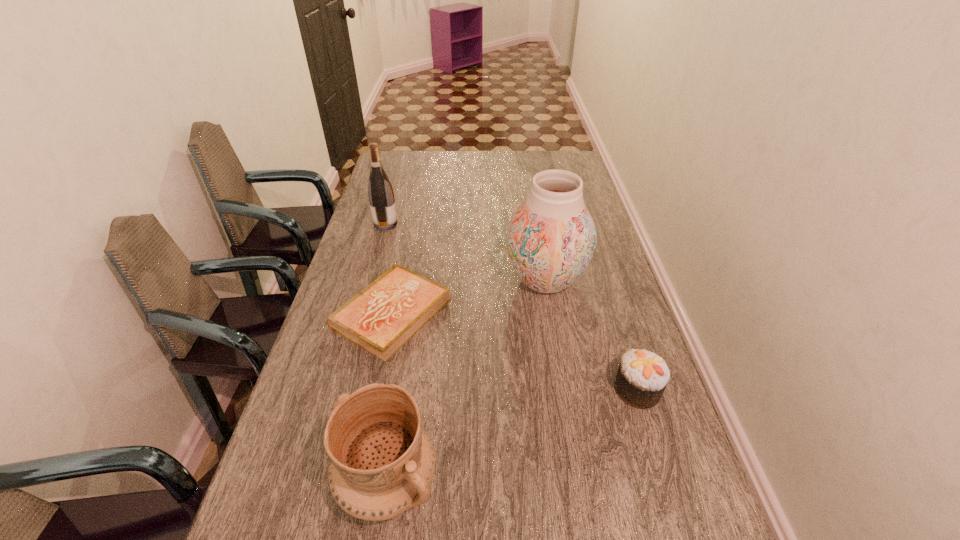
In the image, there is a desktop. Identify the location of vacant space at the far left corner. This screenshot has width=960, height=540. (393, 151).

This screenshot has height=540, width=960. Identify the location of blank space at the far right corner of the desktop. (549, 158).

Image resolution: width=960 pixels, height=540 pixels. I want to click on unoccupied position between the hardback book and the vase, so click(x=468, y=297).

Identify the location of free spot between the shortest object and the farthest object. This screenshot has width=960, height=540. (389, 269).

Image resolution: width=960 pixels, height=540 pixels. I want to click on free space between the wine bottle and the vase, so click(x=466, y=252).

Where is `vacant area that lies between the farthest object and the hardback book`? The width and height of the screenshot is (960, 540). vacant area that lies between the farthest object and the hardback book is located at coordinates (389, 269).

At what (x,y) coordinates should I click in order to perform the action: click on free space between the fourth tallest object and the vase. Please return your answer as a coordinate pair (x, y). This screenshot has width=960, height=540. Looking at the image, I should click on (591, 335).

The image size is (960, 540). Identify the location of free space between the shortest object and the vase. (468, 297).

Where is `unoccupied position between the wine bottle and the vase`? unoccupied position between the wine bottle and the vase is located at coordinates (466, 252).

I want to click on vacant area that lies between the third tallest object and the vase, so click(x=467, y=381).